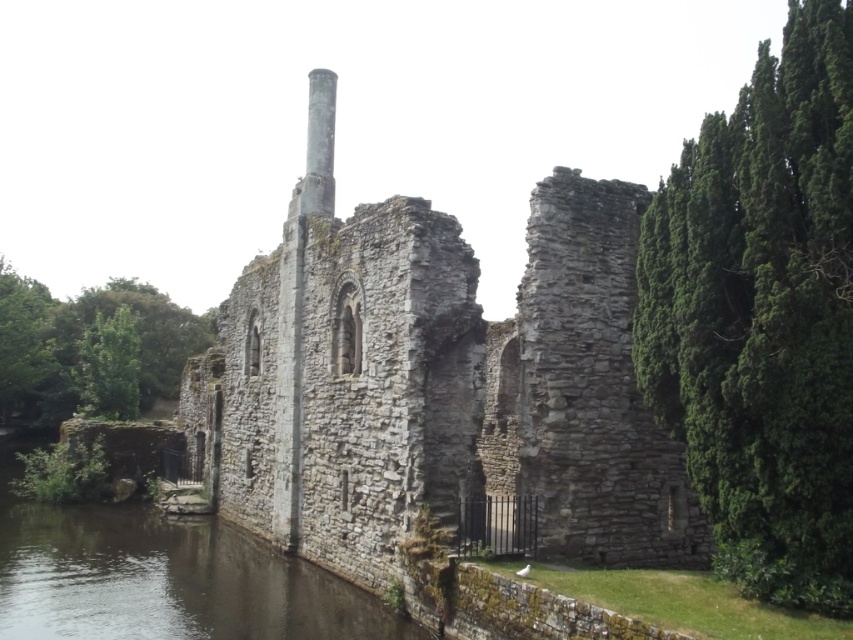
You are standing at the base of the historic stone structure and want to determine which of the two points, point [549,314] or point [376,609], is closer to you. Based on the scene, which point is nearer?

Point [549,314] is closer to the viewer than point [376,609].

You are standing at the point marked as point (434, 380) in the image of the historic stone ruins. What object is located exactly at that coordinate?

The stone wall at center is located exactly at point (434, 380).

You are a tourist visiting the ruins and want to take a photo of the stone wall at center and the dark gray stone river at lower left. Which object should you focus on first if you want to capture both in a single frame without moving the camera?

The stone wall at center is located above the dark gray stone river at lower left, so you should focus on the stone wall at center first as it is higher up to include both in the frame.